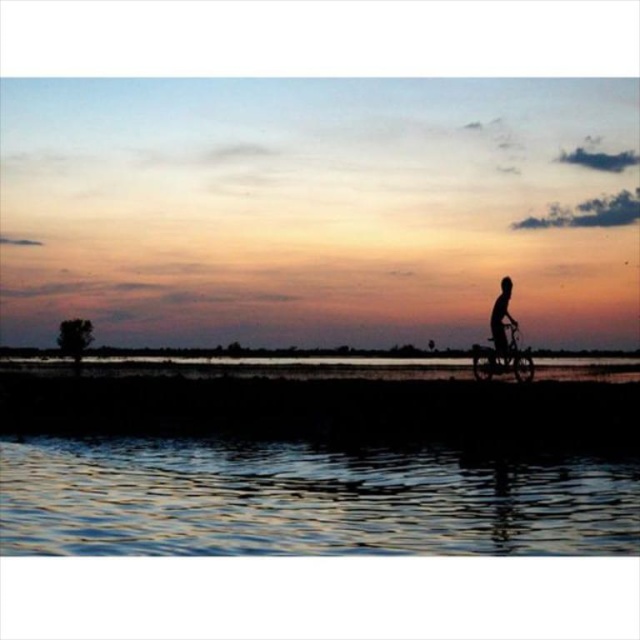
You are a photographer trying to capture the silhouette human at right and the shiny metallic bicycle at right in a single frame. Based on their positions, which object should you adjust your camera focus to first to ensure both are in the frame?

The shiny metallic bicycle at right is positioned on the left side of silhouette human at right, so you should focus on the silhouette human at right first to ensure both fit within the frame.

You are standing at the point with coordinates point [504,340] and want to move towards the horizon. Is the point point [202,385] located behind you or in front of you?

The point point [202,385] is behind point [504,340], so it is located behind you.